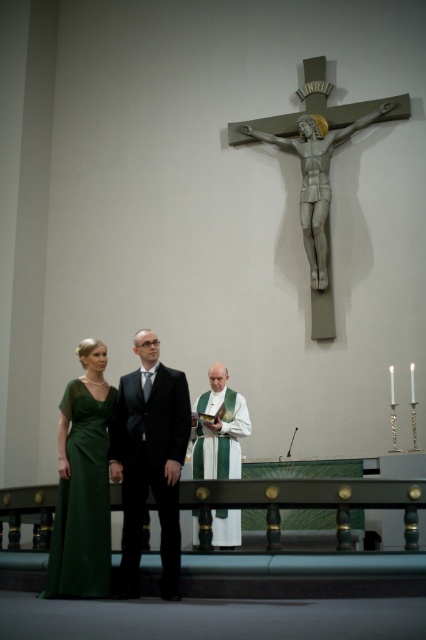
Question: Which point appears closest to the camera in this image?

Choices:
 (A) (86, 564)
 (B) (138, 444)
 (C) (164, 502)

Answer: (A)

Question: Can you confirm if shiny black suit at center is positioned above green satin dress at left?

Choices:
 (A) yes
 (B) no

Answer: (A)

Question: Which point is farther to the camera?

Choices:
 (A) shiny black suit at center
 (B) green satin dress at left
 (C) white/green fabric vestment at center

Answer: (C)

Question: Does green satin dress at left have a lesser width compared to white/green fabric vestment at center?

Choices:
 (A) no
 (B) yes

Answer: (B)

Question: Estimate the real-world distances between objects in this image. Which object is closer to the green satin dress at left?

Choices:
 (A) white/green fabric vestment at center
 (B) green satin dress at center
 (C) shiny black suit at center

Answer: (B)

Question: Does green satin dress at center appear on the left side of green satin dress at left?

Choices:
 (A) no
 (B) yes

Answer: (A)